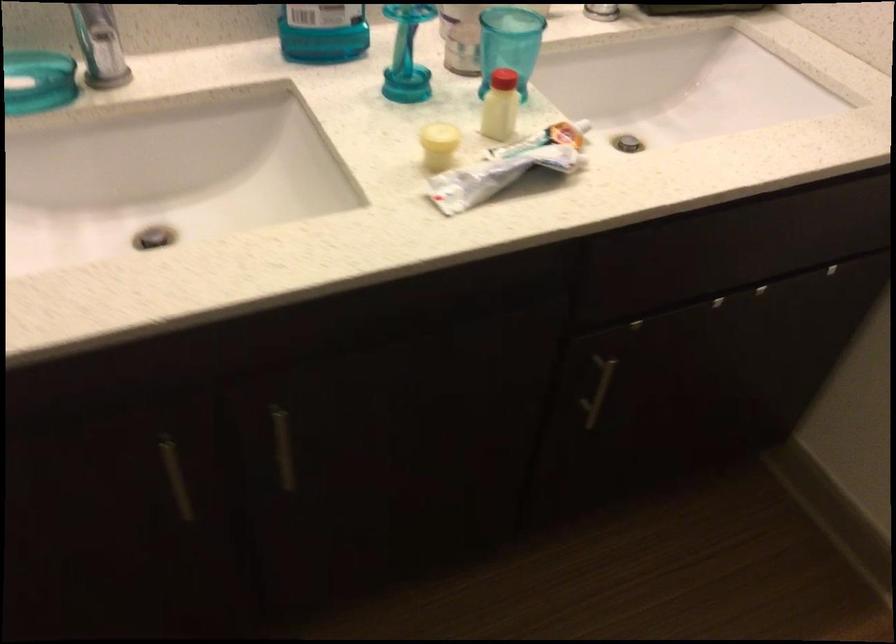
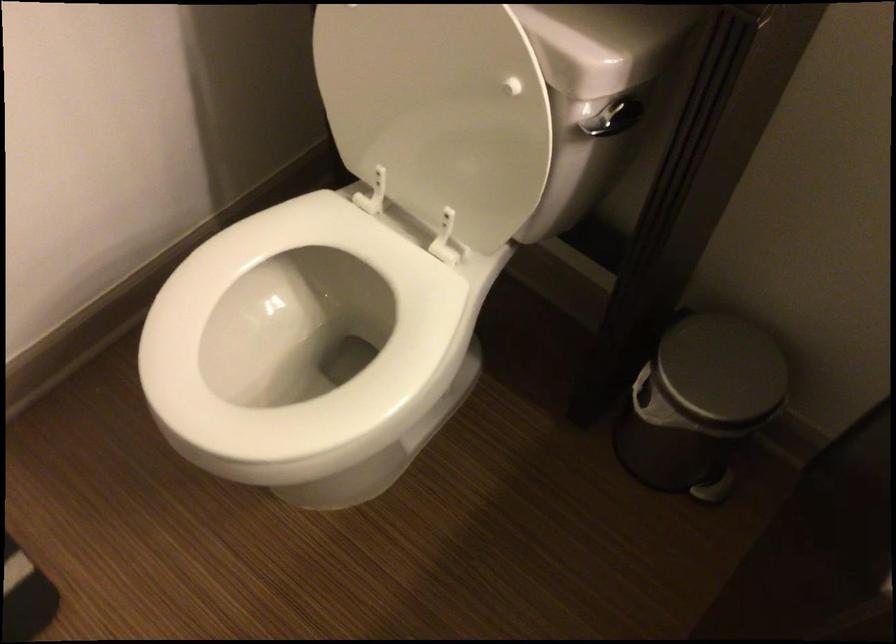
Based on the photo, how did the camera likely rotate?

The rotation direction of the camera is left-down.